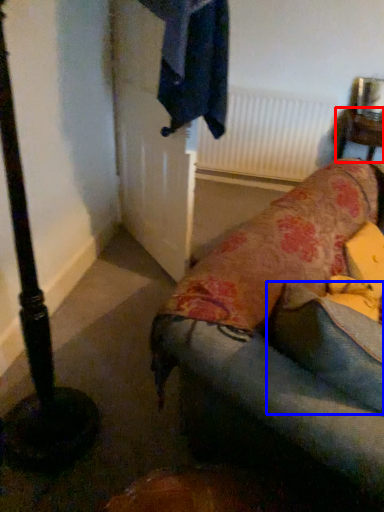
Question: Which object appears farthest to the camera in this image, furniture (highlighted by a red box) or pillow (highlighted by a blue box)?

Choices:
 (A) furniture
 (B) pillow

Answer: (A)